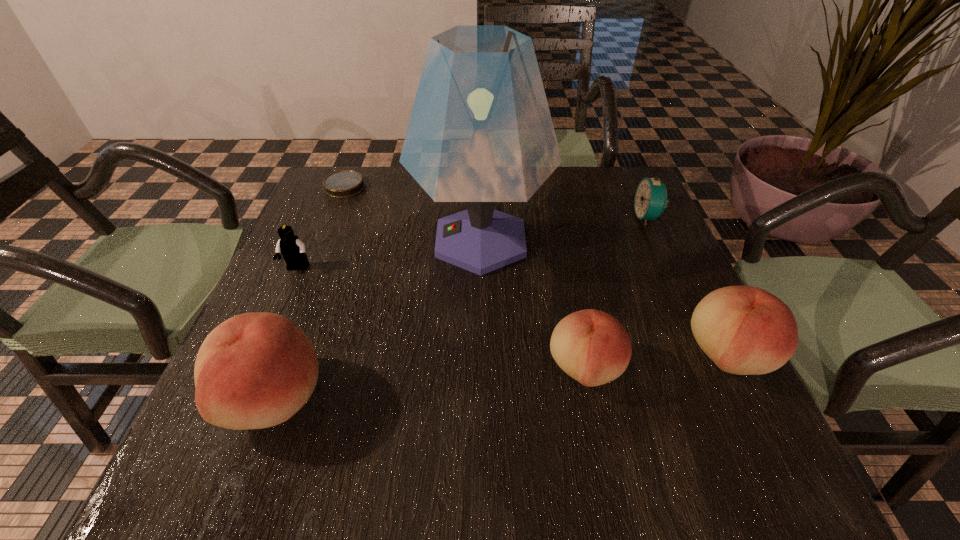
Find the location of a particular element. free space located 0.200m on the left of the third tallest object is located at coordinates (580, 355).

I want to click on free location located 0.240m on the base of the lampshade, so click(x=311, y=241).

Locate an element on the screen. This screenshot has height=540, width=960. free spot located 0.290m on the base of the lampshade is located at coordinates (291, 241).

Find the location of a particular element. Image resolution: width=960 pixels, height=540 pixels. blank space located on the base of the lampshade is located at coordinates click(x=377, y=241).

Find the location of a particular element. The height and width of the screenshot is (540, 960). free space located 0.060m on the back of the farthest object is located at coordinates (353, 166).

Image resolution: width=960 pixels, height=540 pixels. In order to click on free space located on the front-facing side of the alarm clock in this screenshot , I will do `click(488, 217)`.

At what (x,y) coordinates should I click in order to perform the action: click on vacant space located 0.230m on the front-facing side of the alarm clock. Please return your answer as a coordinate pair (x, y). Looking at the image, I should click on tap(546, 217).

At what (x,y) coordinates should I click in order to perform the action: click on blank space located on the front-facing side of the alarm clock. Please return your answer as a coordinate pair (x, y). The height and width of the screenshot is (540, 960). Looking at the image, I should click on (519, 217).

Locate an element on the screen. free space located on the front-facing side of the Lego is located at coordinates (271, 331).

I want to click on lampshade positioned at the far edge, so point(480,132).